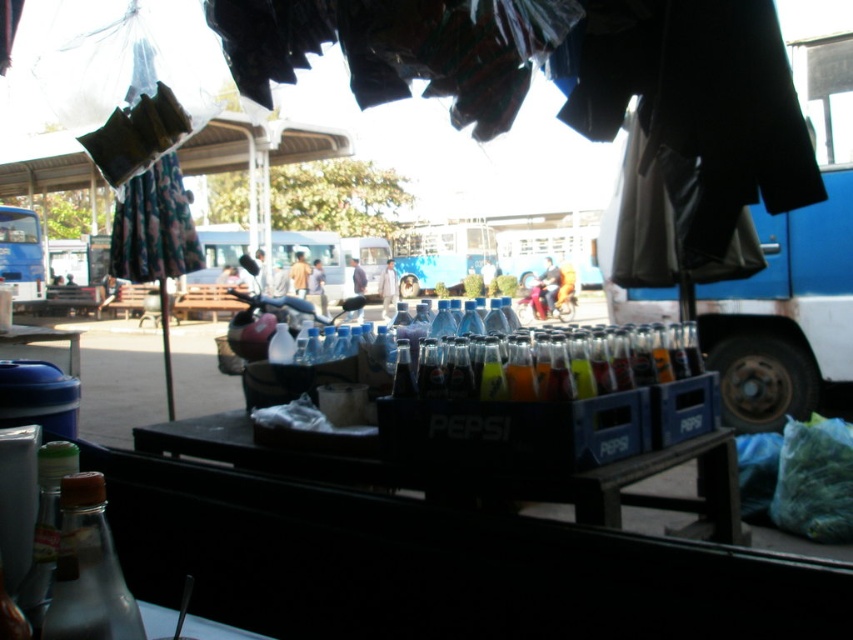
Is translucent glass bottle at lower left above matte plastic bottle at center?

Incorrect, translucent glass bottle at lower left is not positioned above matte plastic bottle at center.

Between point (39, 515) and point (549, 308), which one is positioned behind?

The point (549, 308) is behind.

Identify the location of translucent glass bottle at lower left. (45, 525).

Can you confirm if metallic blue truck at right is positioned below translucent plastic bottles at center?

No.

Who is positioned more to the right, metallic blue truck at right or translucent plastic bottles at center?

Positioned to the right is metallic blue truck at right.

Does point (849, 166) come closer to viewer compared to point (512, 397)?

No, it is not.

Where is `metallic blue truck at right`? metallic blue truck at right is located at coordinates (785, 316).

Is translucent glass bottle at lower left in front of blue matte bus at left?

Yes, it is in front of blue matte bus at left.

Between translucent glass bottle at lower left and blue matte bus at left, which one is positioned higher?

blue matte bus at left is above.

Image resolution: width=853 pixels, height=640 pixels. What do you see at coordinates (45, 525) in the screenshot?
I see `translucent glass bottle at lower left` at bounding box center [45, 525].

Locate an element on the screen. The width and height of the screenshot is (853, 640). translucent glass bottle at lower left is located at coordinates (45, 525).